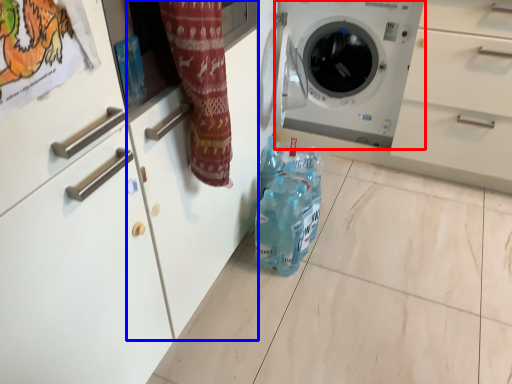
Question: Which of the following is the closest to the observer, washing machine (highlighted by a red box) or cabinetry (highlighted by a blue box)?

Choices:
 (A) washing machine
 (B) cabinetry

Answer: (B)